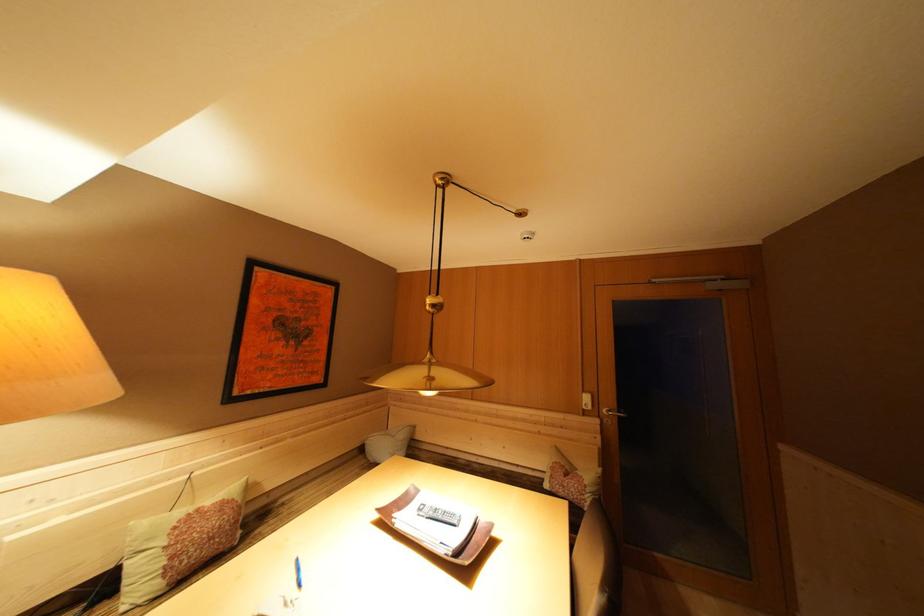
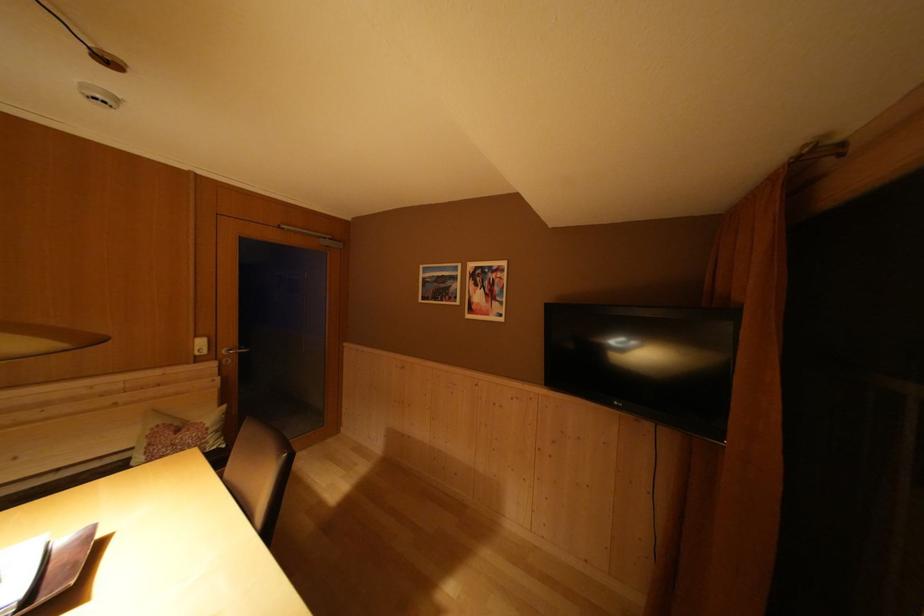
The point at (609, 430) is marked in the first image. Where is the corresponding point in the second image?

(226, 371)